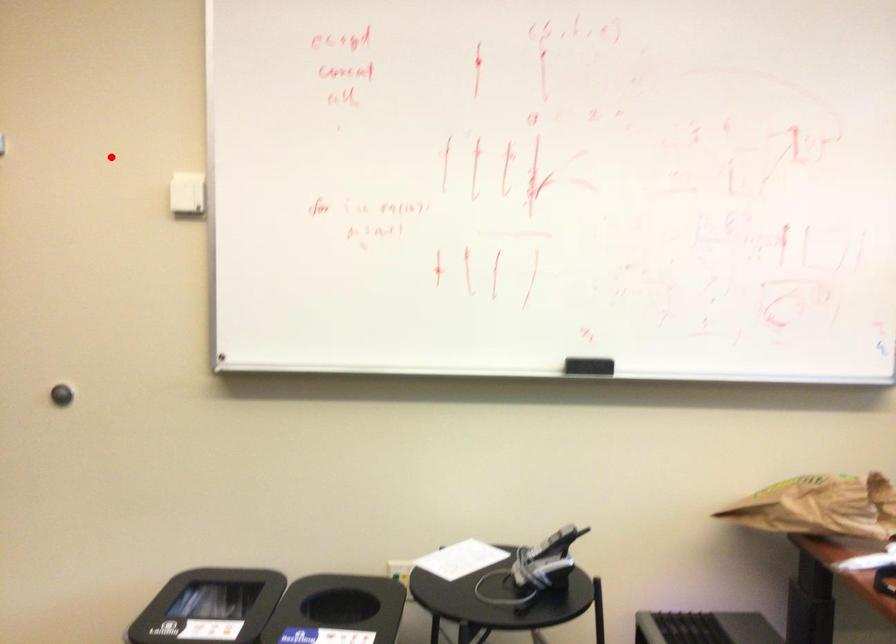
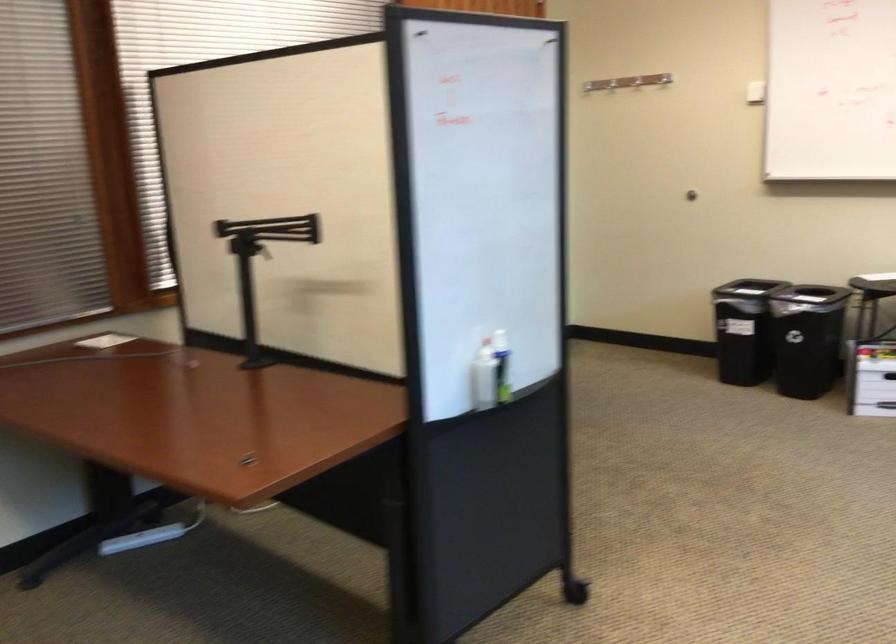
Question: I am providing you with two images of the same scene from different viewpoints. Given a red point in image1, look at the same physical point in image2. Is it:

Choices:
 (A) Closer to the viewpoint
 (B) Farther from the viewpoint

Answer: (B)